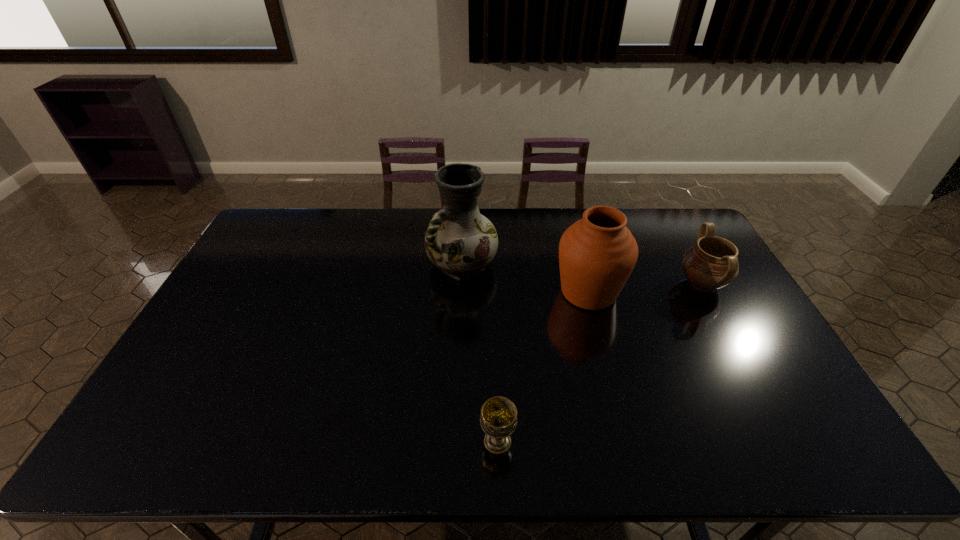
Locate an element on the screen. the tallest object is located at coordinates (460, 241).

Where is `the third shortest object`? The image size is (960, 540). the third shortest object is located at coordinates (597, 254).

The image size is (960, 540). What are the coordinates of `the taller urn` in the screenshot? It's located at (597, 254).

Identify the location of the second shortest object. tap(711, 263).

Image resolution: width=960 pixels, height=540 pixels. I want to click on the rightmost object, so pyautogui.click(x=711, y=263).

At what (x,y) coordinates should I click in order to perform the action: click on the shortest object. Please return your answer as a coordinate pair (x, y). Looking at the image, I should click on (498, 419).

The image size is (960, 540). In order to click on chalice in this screenshot , I will do `click(498, 419)`.

Identify the location of vacant space located on the back of the vase. (465, 211).

Find the location of a particular element. Image resolution: width=960 pixels, height=540 pixels. free location located 0.200m on the right of the left urn is located at coordinates (686, 292).

Locate an element on the screen. The image size is (960, 540). vacant region located 0.060m on the front-facing side of the rightmost object is located at coordinates (658, 284).